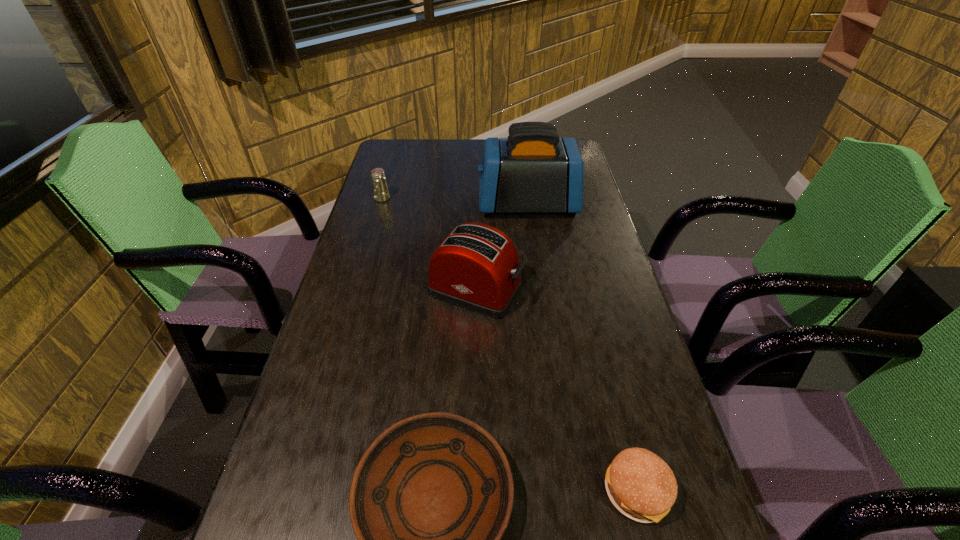
I want to click on the farther toaster, so click(533, 170).

You are a GUI agent. You are given a task and a screenshot of the screen. Output one action in this format:
    pyautogui.click(x=<x>, y=<y>)
    Task: Click on the tallest object
    The width and height of the screenshot is (960, 540).
    Given the screenshot: What is the action you would take?
    click(x=533, y=170)

Identify the location of the nearer toaster. (476, 267).

Where is `the third farthest object`? the third farthest object is located at coordinates (476, 267).

This screenshot has width=960, height=540. Find the location of `the leftmost object`. the leftmost object is located at coordinates point(381,193).

Identify the location of the third tallest object. (381, 193).

Image resolution: width=960 pixels, height=540 pixels. I want to click on hamburger, so click(x=640, y=484).

This screenshot has height=540, width=960. In order to click on free region located 0.230m on the front-facing side of the farther toaster in this screenshot , I will do `click(408, 205)`.

Where is `vacant space located 0.210m on the front-facing side of the farther toaster`? Image resolution: width=960 pixels, height=540 pixels. vacant space located 0.210m on the front-facing side of the farther toaster is located at coordinates (415, 205).

I want to click on free space located 0.120m on the front-facing side of the farther toaster, so click(x=442, y=205).